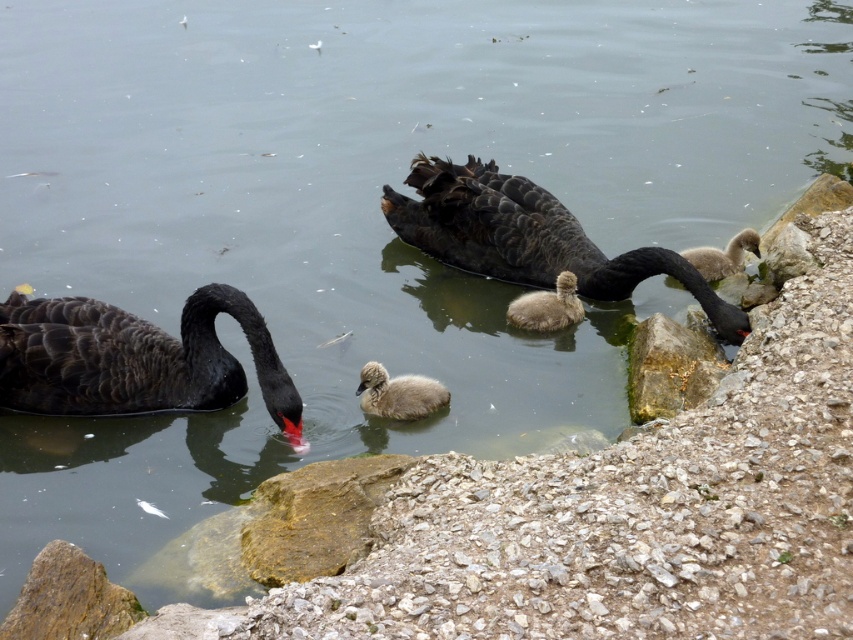
You are standing at the edge of the water and see two points in the image. The first point is labeled as point (192,403) and the second is point (668,332). If you want to reach the point that is closer to you, which point should you head towards?

Point (192,403) is in front of point (668,332), so you should head towards point (192,403) to reach the one closer to you.

You are a wildlife photographer standing on a dock and want to capture a closeup shot of the black glossy swan at center. Your camera has a minimum focusing distance of 5 meters. Can you take the photo without moving closer?

The black glossy swan at center and camera are 4.83 meters apart from each other. Since the minimum focusing distance is 5 meters, the camera cannot focus because the distance is less than required. Move back to increase the distance to at least 5 meters for a clear shot.